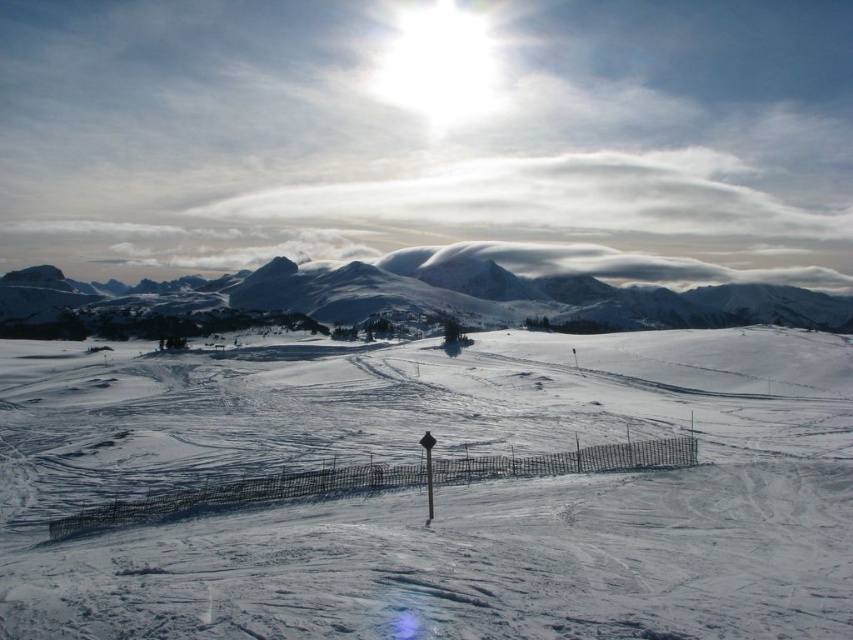
Question: Can you confirm if white powdery snow at center is bigger than snowy mountain at upper center?

Choices:
 (A) no
 (B) yes

Answer: (A)

Question: Is white powdery snow at center positioned in front of snowy mountain at upper center?

Choices:
 (A) no
 (B) yes

Answer: (B)

Question: Can you confirm if white powdery snow at center is positioned to the left of snowy mountain at upper center?

Choices:
 (A) yes
 (B) no

Answer: (A)

Question: Which point appears closest to the camera in this image?

Choices:
 (A) (729, 314)
 (B) (97, 445)

Answer: (B)